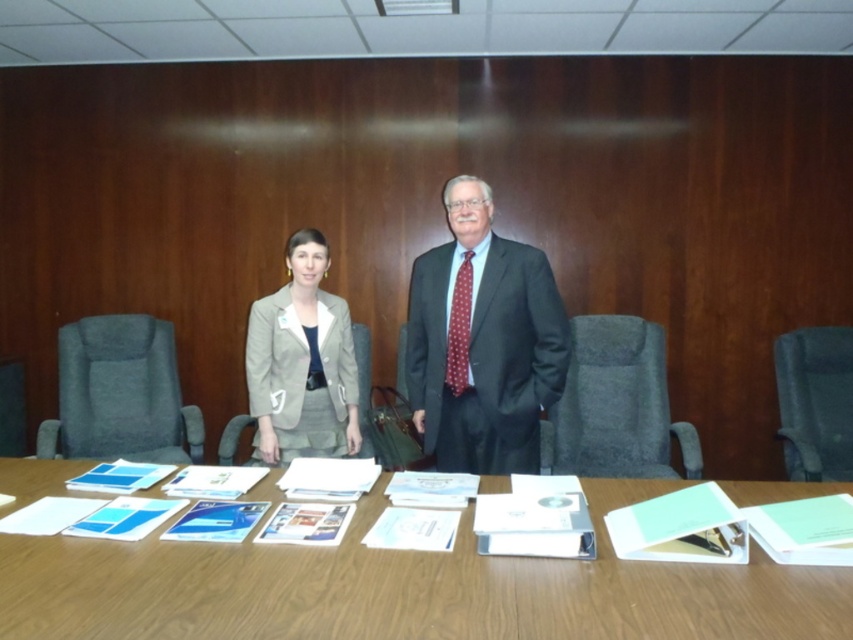
Does point (795, 604) lie behind point (473, 353)?

No, (795, 604) is closer to viewer.

Can you confirm if wooden table at center is positioned below dark gray suit at center?

Indeed, wooden table at center is positioned under dark gray suit at center.

Image resolution: width=853 pixels, height=640 pixels. What do you see at coordinates (403, 588) in the screenshot?
I see `wooden table at center` at bounding box center [403, 588].

At what (x,y) coordinates should I click in order to perform the action: click on wooden table at center. Please return your answer as a coordinate pair (x, y). This screenshot has width=853, height=640. Looking at the image, I should click on (403, 588).

Is gray fabric chair at left wider than beige fabric chair at center?

Yes.

Is gray fabric chair at left bigger than beige fabric chair at center?

Correct, gray fabric chair at left is larger in size than beige fabric chair at center.

Describe the element at coordinates (120, 394) in the screenshot. I see `gray fabric chair at left` at that location.

Find the location of `gray fabric chair at left`. gray fabric chair at left is located at coordinates (120, 394).

Is wooden table at center to the left of black fabric chair at right from the viewer's perspective?

Yes, wooden table at center is to the left of black fabric chair at right.

Does wooden table at center lie in front of black fabric chair at right?

Yes.

At what (x,y) coordinates should I click in order to perform the action: click on wooden table at center. Please return your answer as a coordinate pair (x, y). The image size is (853, 640). Looking at the image, I should click on (403, 588).

Find the location of `wooden table at center`. wooden table at center is located at coordinates (403, 588).